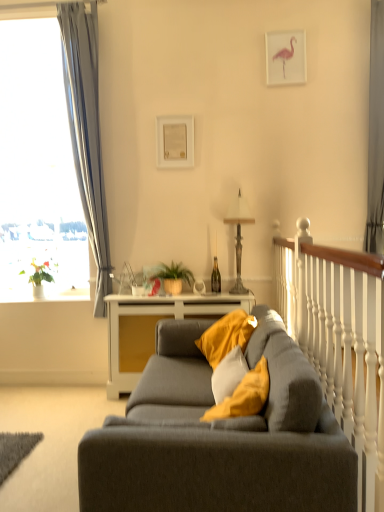
Question: Would you say metallic gray lamp at center is inside or outside gray fabric curtain at right, which is counted as the 1th curtain, starting from the right?

Choices:
 (A) outside
 (B) inside

Answer: (A)

Question: In terms of size, does metallic gray lamp at center appear bigger or smaller than gray fabric curtain at right, which appears as the 2th curtain when viewed from the left?

Choices:
 (A) big
 (B) small

Answer: (B)

Question: Which is nearer to the silky gray curtain at left, the 1th curtain positioned from the left?

Choices:
 (A) gray fabric curtain at right, which appears as the 2th curtain when viewed from the left
 (B) matte gray couch at center
 (C) soft yellow cushion at center
 (D) white glossy window at left
 (E) white wooden railing at right

Answer: (D)

Question: Estimate the real-world distances between objects in this image. Which object is farther from the white wooden railing at right?

Choices:
 (A) white glossy window at left
 (B) white wood table at center
 (C) silky gray curtain at left, the 1th curtain positioned from the left
 (D) pink paper picture frame at upper center, the second picture frame when ordered from left to right
 (E) white paper at upper center, the first picture frame viewed from the back

Answer: (A)